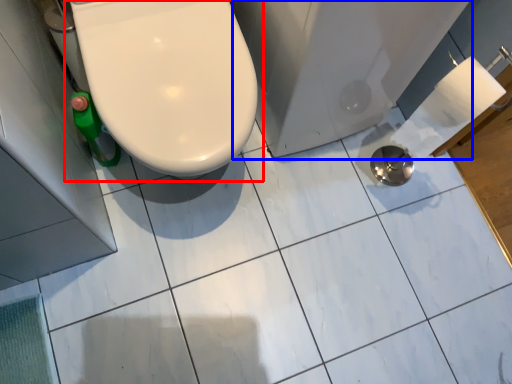
Question: Which of the following is the closest to the observer, toilet (highlighted by a red box) or bath (highlighted by a blue box)?

Choices:
 (A) toilet
 (B) bath

Answer: (A)